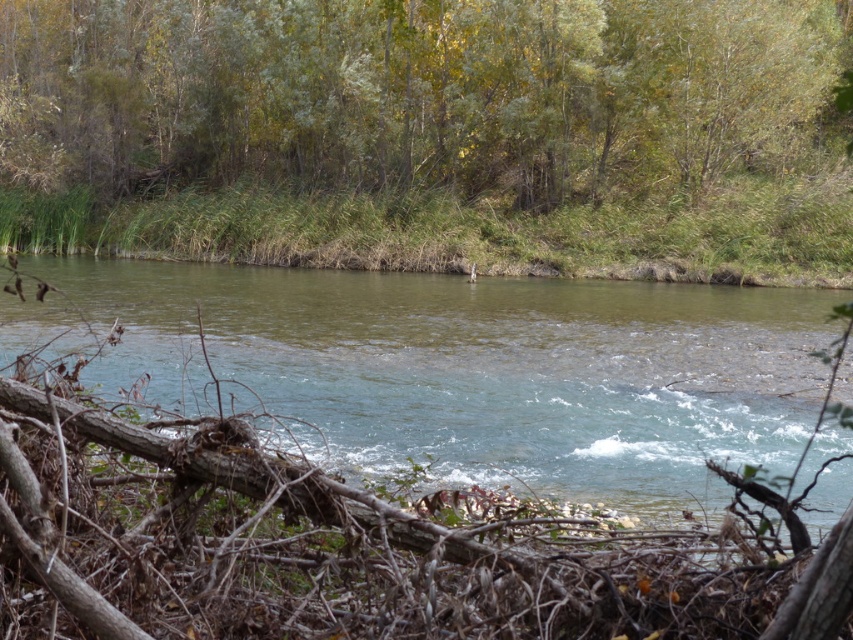
Is green leafy trees at upper center smaller than clear water at center?

Actually, green leafy trees at upper center might be larger than clear water at center.

What do you see at coordinates (419, 92) in the screenshot? This screenshot has height=640, width=853. I see `green leafy trees at upper center` at bounding box center [419, 92].

Does point (288, 74) come farther from viewer compared to point (605, 468)?

That is True.

Identify the location of green leafy trees at upper center. (419, 92).